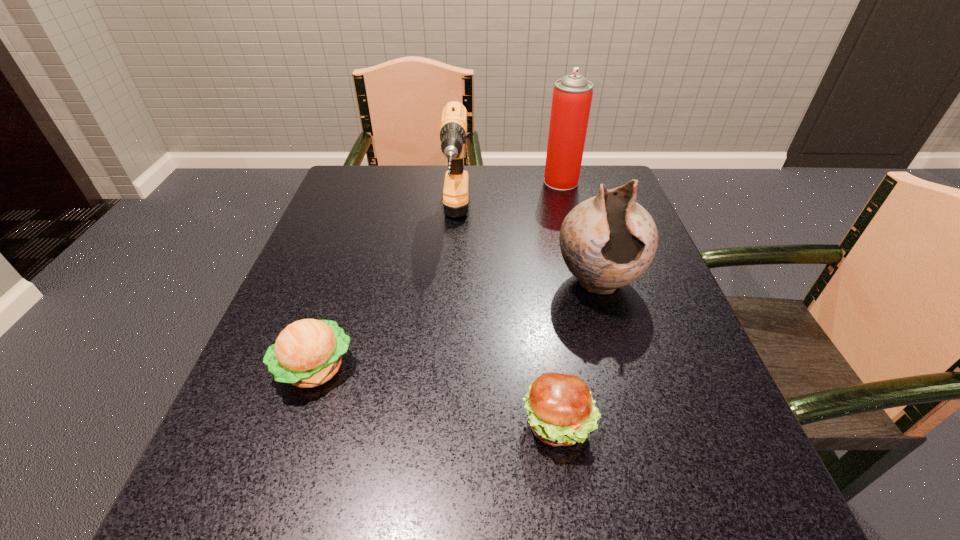
The width and height of the screenshot is (960, 540). I want to click on aerosol can, so tap(572, 95).

The width and height of the screenshot is (960, 540). I want to click on drill, so click(453, 127).

Locate an element on the screen. The image size is (960, 540). pottery is located at coordinates (608, 241).

This screenshot has height=540, width=960. Find the location of `the left hamburger`. the left hamburger is located at coordinates (307, 353).

The width and height of the screenshot is (960, 540). In order to click on the right hamburger in this screenshot , I will do `click(561, 412)`.

This screenshot has height=540, width=960. I want to click on vacant area located 0.360m on the front of the tallest object, so (588, 285).

This screenshot has width=960, height=540. I want to click on blank space located at the tip of the second object from left to right, so click(x=443, y=410).

What are the coordinates of `vacant space situated 0.300m from the spout of the pottery` in the screenshot? It's located at (654, 474).

Identify the location of vacant area situated on the back of the left hamburger. The height and width of the screenshot is (540, 960). click(x=348, y=271).

Where is `free space located on the right of the right hamburger`? This screenshot has width=960, height=540. free space located on the right of the right hamburger is located at coordinates (702, 424).